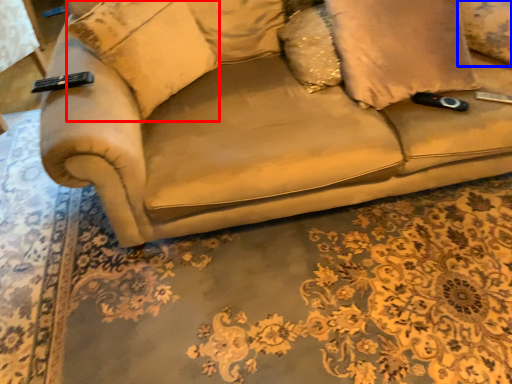
Question: Which object appears farthest to the camera in this image, pillow (highlighted by a red box) or pillow (highlighted by a blue box)?

Choices:
 (A) pillow
 (B) pillow

Answer: (B)